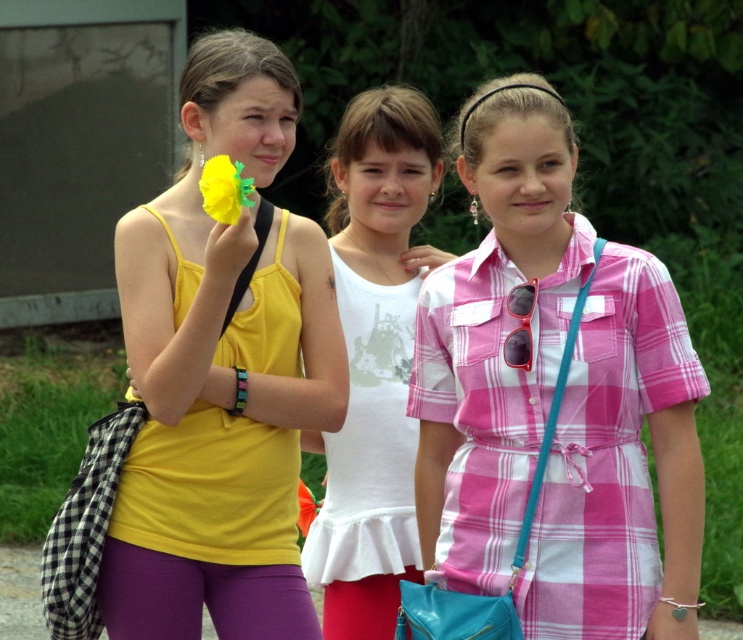
You are a photographer trying to capture a closeup of the yellow matte flower at upper center. The matte yellow tank top at center is blocking your view. Can you determine if the flower is shorter than the tank top?

The matte yellow tank top at center is taller than the yellow matte flower at upper center, so the flower is shorter and might be partially hidden behind the tank top.

You are a photographer trying to capture the three girls in the scene. You notice a specific point at coordinates (221, 374). What object is located at this point?

The point at (221, 374) indicates the matte yellow tank top at center.

You are a fashion designer observing the image. You need to decide which item has a greater width for a clothing line design. Which one is wider between the matte yellow tank top at center and the yellow matte flower at upper center?

The matte yellow tank top at center has a greater width than the yellow matte flower at upper center according to the description.